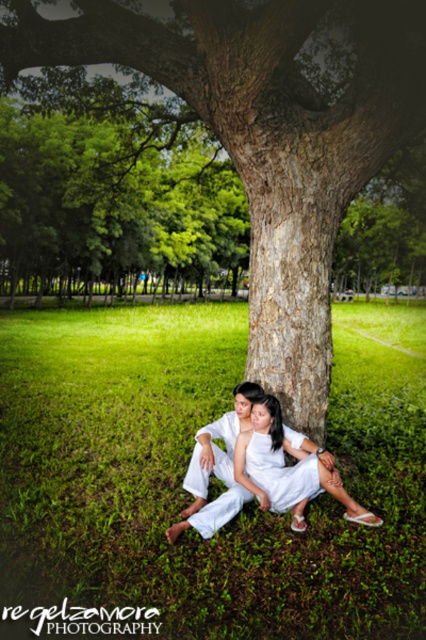
Measure the distance between white cotton dress at center and camera.

white cotton dress at center is 13.96 feet away from camera.

Between point (287, 488) and point (273, 500), which one is positioned in front?

Point (287, 488) is more forward.

Is point (170, 541) behind point (270, 500)?

No, it is not.

I want to click on white cotton dress at center, so click(x=265, y=472).

At what (x,y) coordinates should I click in order to perform the action: click on green grass at lower center. Please return your answer as a coordinate pair (x, y). The image size is (426, 640). Looking at the image, I should click on (186, 468).

Does green grass at lower center have a greater height compared to white satin dress at center?

Indeed, green grass at lower center has a greater height compared to white satin dress at center.

Where is `green grass at lower center`? green grass at lower center is located at coordinates (186, 468).

Is green rough bark tree at center further to camera compared to white cotton dress at center?

Yes, green rough bark tree at center is further from the viewer.

Which of these two, green rough bark tree at center or white cotton dress at center, stands shorter?

With less height is white cotton dress at center.

This screenshot has height=640, width=426. What are the coordinates of `green rough bark tree at center` in the screenshot? It's located at (267, 132).